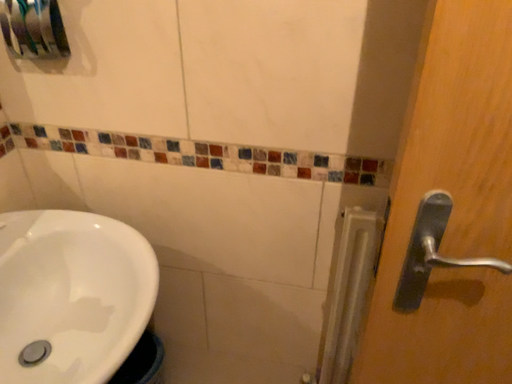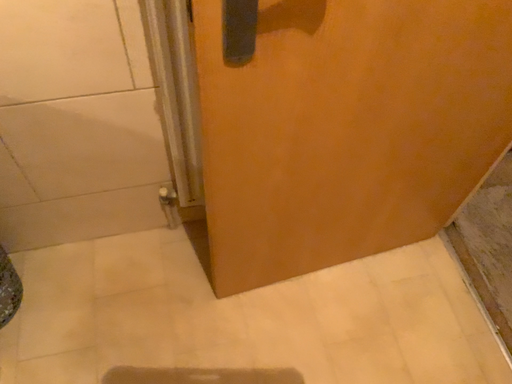
Question: How did the camera likely rotate when shooting the video?

Choices:
 (A) rotated right
 (B) rotated left

Answer: (A)